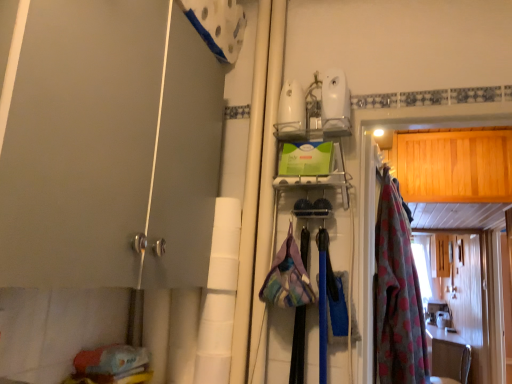
Question: Can you confirm if wooden cabinet at right is positioned to the left of matte gray door at left?

Choices:
 (A) yes
 (B) no

Answer: (B)

Question: From the image's perspective, is wooden cabinet at right located above matte gray door at left?

Choices:
 (A) no
 (B) yes

Answer: (A)

Question: Is wooden cabinet at right bigger than matte gray door at left?

Choices:
 (A) yes
 (B) no

Answer: (B)

Question: From a real-world perspective, is wooden cabinet at right physically above matte gray door at left?

Choices:
 (A) no
 (B) yes

Answer: (B)

Question: Does wooden cabinet at right turn towards matte gray door at left?

Choices:
 (A) yes
 (B) no

Answer: (B)

Question: Visually, is wooden cabinet at right positioned to the left or to the right of pink floral fabric at right?

Choices:
 (A) left
 (B) right

Answer: (B)

Question: From their relative heights in the image, would you say wooden cabinet at right is taller or shorter than pink floral fabric at right?

Choices:
 (A) short
 (B) tall

Answer: (A)

Question: Based on their sizes in the image, would you say wooden cabinet at right is bigger or smaller than pink floral fabric at right?

Choices:
 (A) big
 (B) small

Answer: (A)

Question: From a real-world perspective, is wooden cabinet at right positioned above or below pink floral fabric at right?

Choices:
 (A) above
 (B) below

Answer: (A)

Question: In the image, is pink floral fabric at right on the left side or the right side of matte gray door at left?

Choices:
 (A) right
 (B) left

Answer: (A)

Question: From a real-world perspective, is pink floral fabric at right positioned above or below matte gray door at left?

Choices:
 (A) below
 (B) above

Answer: (A)

Question: Is pink floral fabric at right situated inside matte gray door at left or outside?

Choices:
 (A) inside
 (B) outside

Answer: (B)

Question: Considering their positions, is pink floral fabric at right located in front of or behind matte gray door at left?

Choices:
 (A) behind
 (B) front

Answer: (A)

Question: In the image, is matte gray door at left positioned in front of or behind pink floral fabric at right?

Choices:
 (A) behind
 (B) front

Answer: (B)

Question: Does point (14, 102) appear closer or farther from the camera than point (388, 266)?

Choices:
 (A) closer
 (B) farther

Answer: (A)